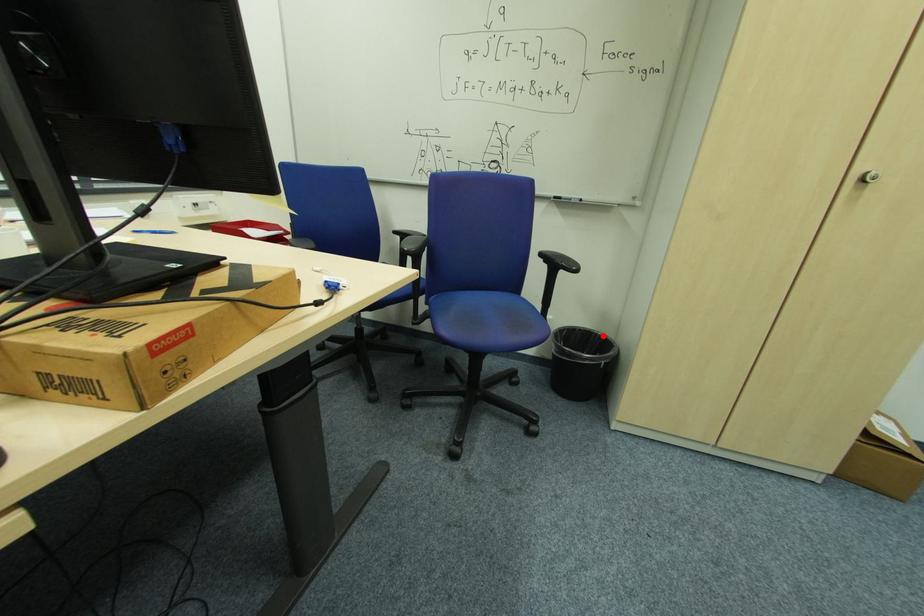
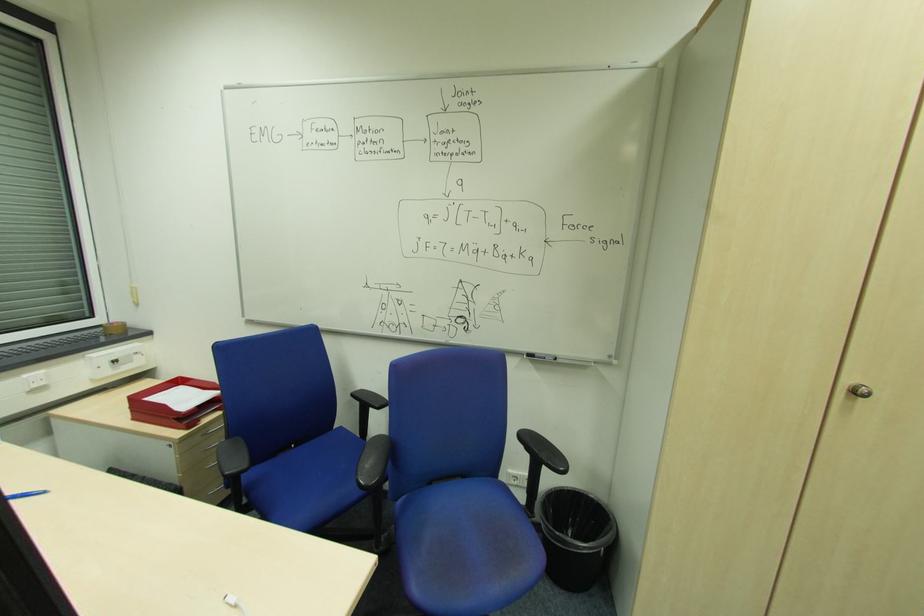
Locate, in the second image, the point that corresponds to the highlighted location in the first image.

(594, 499)